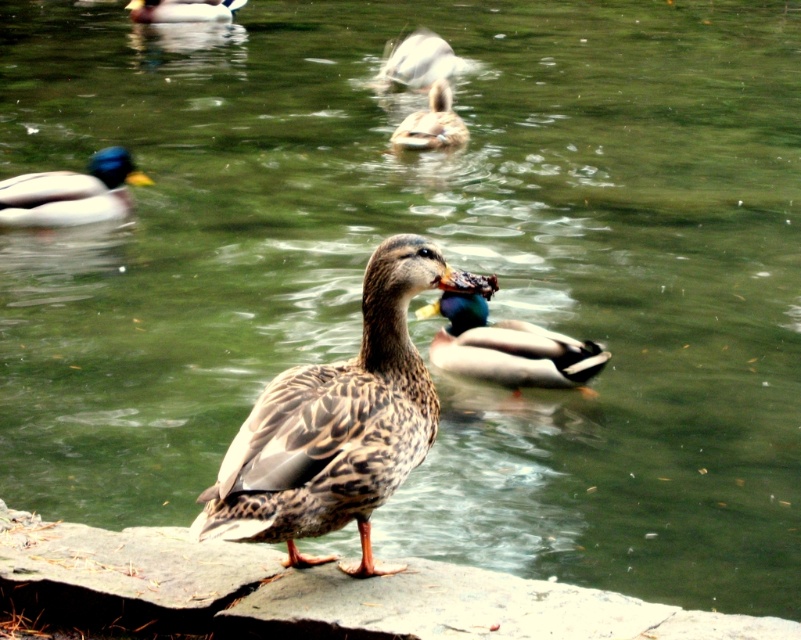
In the scene shown: You are a birdwatcher observing the ducks in the pond. You notice the shiny green drake at center and the speckled feathered duck at upper center. Which duck is located higher in the image?

The speckled feathered duck at upper center is higher in the image because it is positioned above the shiny green drake at center.

You are standing at the center of the pond. Which direction should you walk to reach the shiny green drake at left?

Since the shiny green drake at left is located at point 0.302 on the x and 0.089 on the y, you should walk to the left to reach it.